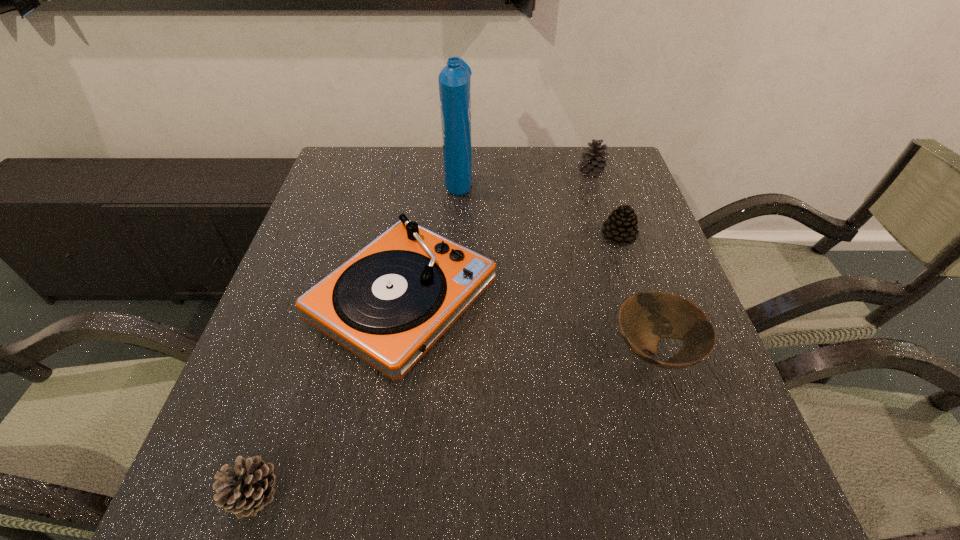
Find the location of `unoccupied area between the record player and the farthest pinecone`. unoccupied area between the record player and the farthest pinecone is located at coordinates (496, 237).

In order to click on vacant area that lies between the bowl and the nearest object in this screenshot , I will do `click(454, 422)`.

Find the location of a particular element. empty space between the second nearest pinecone and the record player is located at coordinates (511, 268).

At what (x,y) coordinates should I click in order to perform the action: click on vacant area that lies between the shampoo and the bowl. Please return your answer as a coordinate pair (x, y). The height and width of the screenshot is (540, 960). Looking at the image, I should click on (557, 264).

The height and width of the screenshot is (540, 960). I want to click on free space that is in between the shampoo and the second nearest pinecone, so click(539, 207).

This screenshot has height=540, width=960. I want to click on object identified as the second closest to the second nearest pinecone, so click(x=644, y=318).

The image size is (960, 540). I want to click on the second closest object to the second nearest pinecone, so click(x=644, y=318).

Identify the location of the third closest pinecone to the record player. (593, 163).

Point out which pinecone is positioned as the second nearest to the second nearest pinecone. Please provide its 2D coordinates. Your answer should be formatted as a tuple, i.e. [(x, y)], where the tuple contains the x and y coordinates of a point satisfying the conditions above.

[(249, 487)]

I want to click on blank area in the image that satisfies the following two spatial constraints: 1. on the back side of the farthest pinecone; 2. on the right side of the record player, so click(422, 174).